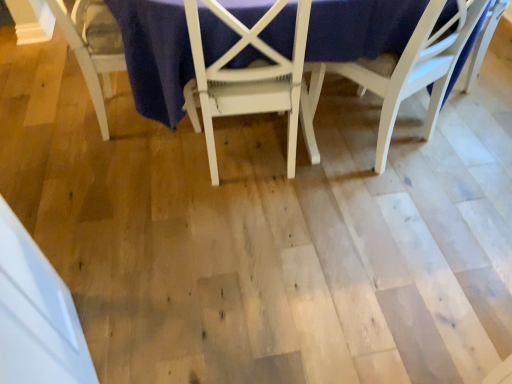
Question: Would you say white wood chair at lower left, which is the 3th chair in right-to-left order, is inside or outside white painted wood chair at center, the 2th chair when ordered from left to right?

Choices:
 (A) outside
 (B) inside

Answer: (A)

Question: In terms of height, does white wood chair at lower left, which is the 3th chair in right-to-left order, look taller or shorter compared to white painted wood chair at center, the 2th chair when ordered from left to right?

Choices:
 (A) tall
 (B) short

Answer: (B)

Question: Estimate the real-world distances between objects in this image. Which object is closer to the white wood chair at upper right, the 3th chair positioned from the left?

Choices:
 (A) white wood chair at lower left, which is the 3th chair in right-to-left order
 (B) white painted wood chair at center, the 2th chair when ordered from left to right
 (C) white painted wood table at center

Answer: (C)

Question: Estimate the real-world distances between objects in this image. Which object is closer to the white wood chair at lower left, which is the 3th chair in right-to-left order?

Choices:
 (A) white wood chair at upper right, the 3th chair positioned from the left
 (B) white painted wood chair at center, the 2th chair when ordered from left to right
 (C) white painted wood table at center

Answer: (C)